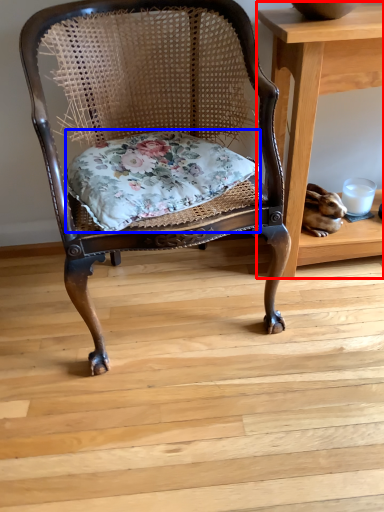
Question: Which of the following is the closest to the observer, table (highlighted by a red box) or pillow (highlighted by a blue box)?

Choices:
 (A) table
 (B) pillow

Answer: (B)